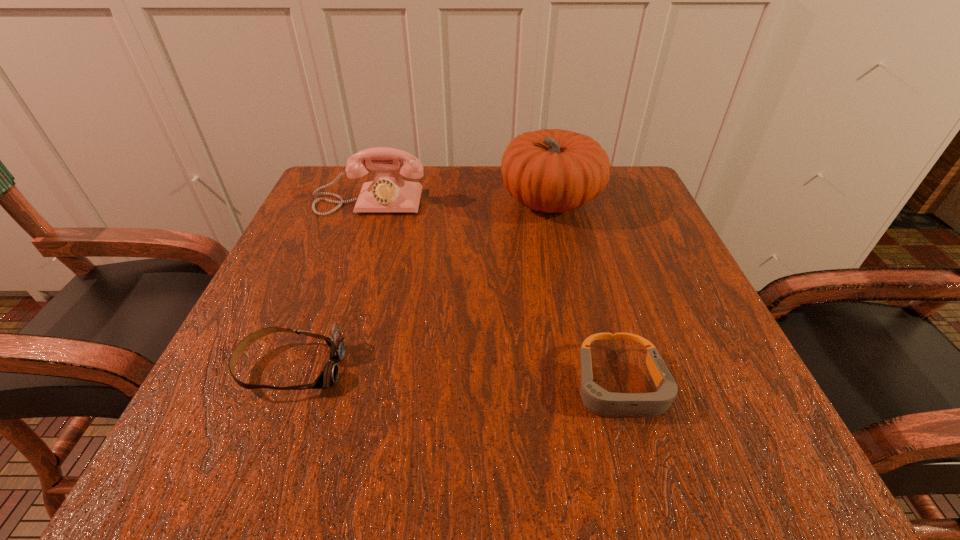
This screenshot has width=960, height=540. In order to click on pumpkin in this screenshot , I will do `click(551, 170)`.

Identify the location of telephone. [x=388, y=192].

This screenshot has width=960, height=540. What are the coordinates of `the left goggles` in the screenshot? It's located at (328, 377).

Where is `the right goggles`? the right goggles is located at coordinates (596, 399).

Image resolution: width=960 pixels, height=540 pixels. Identify the location of free space located 0.320m on the left of the pumpkin. (358, 201).

Where is `free spot located 0.180m on the dial of the telephone`? This screenshot has width=960, height=540. free spot located 0.180m on the dial of the telephone is located at coordinates (346, 272).

Locate an element on the screen. This screenshot has height=540, width=960. free space located 0.170m on the front-facing side of the left goggles is located at coordinates (456, 368).

At what (x,y) coordinates should I click in order to perform the action: click on pumpkin present at the far edge. Please return your answer as a coordinate pair (x, y). The width and height of the screenshot is (960, 540). Looking at the image, I should click on (551, 170).

Where is `telephone located at the far edge`? The width and height of the screenshot is (960, 540). telephone located at the far edge is located at coordinates (388, 192).

Image resolution: width=960 pixels, height=540 pixels. In order to click on object that is at the near edge in this screenshot , I will do `click(596, 399)`.